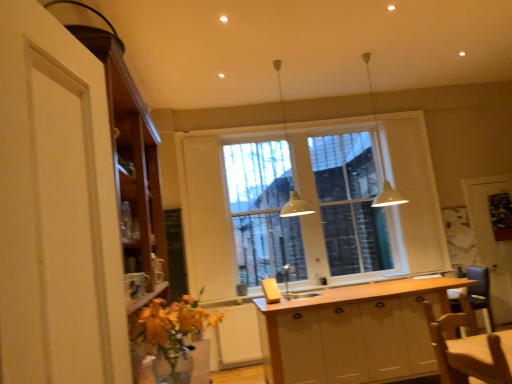
Question: Do you think white wood cabinet at center, the first cabinetry positioned from the right, is within wooden screen door at right, the second screen door when ordered from front to back, or outside of it?

Choices:
 (A) outside
 (B) inside

Answer: (A)

Question: Looking at their shapes, would you say white wood cabinet at center, which is the 2th cabinetry in front-to-back order, is wider or thinner than wooden screen door at right, the 1th screen door when ordered from right to left?

Choices:
 (A) thin
 (B) wide

Answer: (B)

Question: Which is farther from the wooden chair at lower right?

Choices:
 (A) light wood countertop at center
 (B) clear glass window at center
 (C) white matte pendant light at center, acting as the 2th light fixture starting from the right
 (D) white matte screen door at center, acting as the 1th screen door starting from the front
 (E) wooden screen door at right, which appears as the 2th screen door when viewed from the left

Answer: (D)

Question: Estimate the real-world distances between objects in this image. Which object is closer to the white matte screen door at center, the 2th screen door from the back?

Choices:
 (A) wooden screen door at right, which appears as the 2th screen door when viewed from the left
 (B) white wood cabinet at center, marked as the second cabinetry in a top-to-bottom arrangement
 (C) light wood countertop at center
 (D) white matte pendant light at upper center, which is the second light fixture from left to right
 (E) wooden cabinet at left, the second cabinetry in the back-to-front sequence

Answer: (C)